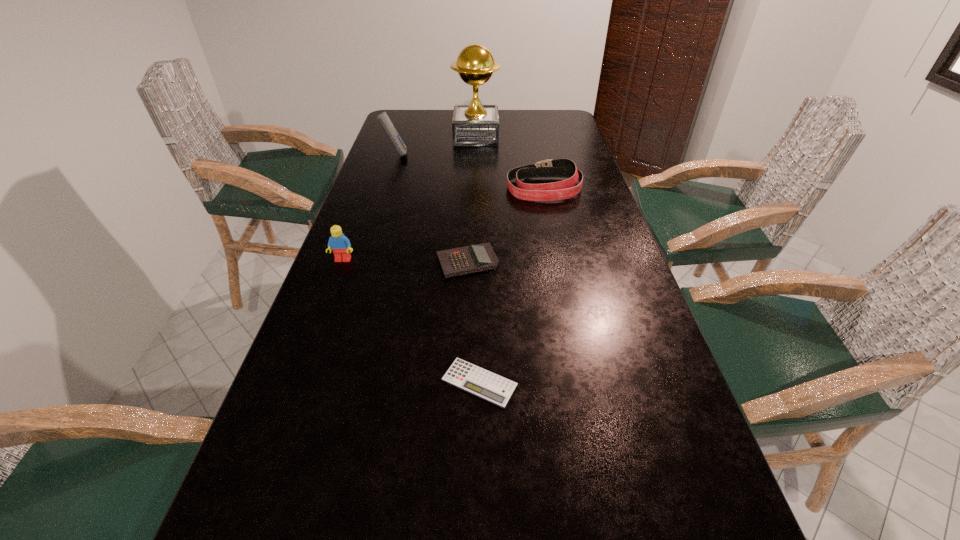
Identify the location of free space that satisfies the following two spatial constraints: 1. on the back side of the rightmost object; 2. on the front-facing side of the tallest calculator. (537, 155).

Locate an element on the screen. free spot that satisfies the following two spatial constraints: 1. on the face of the nearest calculator; 2. on the right side of the Lego is located at coordinates (298, 382).

Where is `vacant area that satisfies the following two spatial constraints: 1. on the front-facing side of the tallest calculator; 2. on the left side of the shortest object`? vacant area that satisfies the following two spatial constraints: 1. on the front-facing side of the tallest calculator; 2. on the left side of the shortest object is located at coordinates (322, 382).

Where is `vacant space that satisfies the following two spatial constraints: 1. on the front-facing side of the award; 2. on the back side of the nearest object`? The height and width of the screenshot is (540, 960). vacant space that satisfies the following two spatial constraints: 1. on the front-facing side of the award; 2. on the back side of the nearest object is located at coordinates (472, 382).

The height and width of the screenshot is (540, 960). Identify the location of free space that satisfies the following two spatial constraints: 1. on the front-facing side of the third farthest object; 2. on the right side of the tallest object. (475, 188).